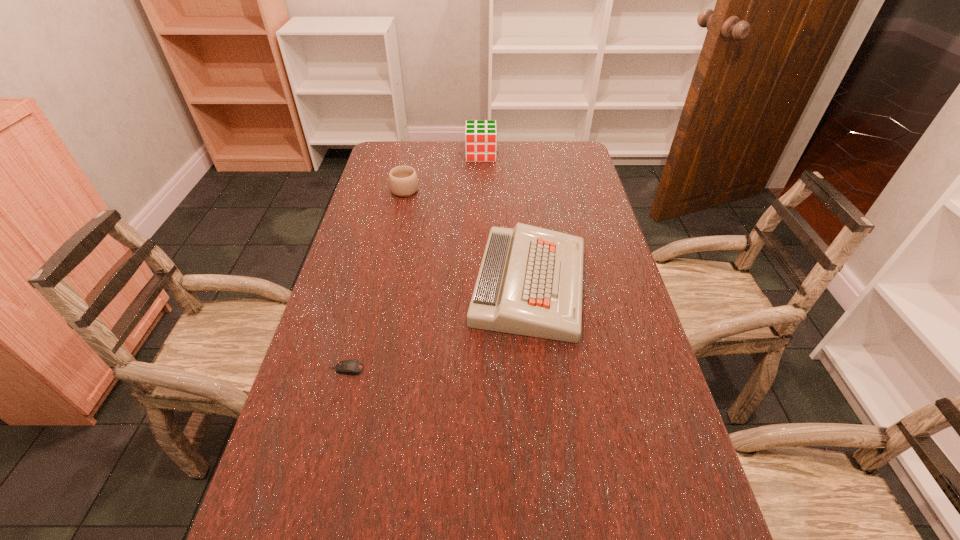
At what (x,y) coordinates should I click in order to perform the action: click on blank space located 0.050m on the back of the third farthest object. Please return your answer as a coordinate pair (x, y). The width and height of the screenshot is (960, 540). Looking at the image, I should click on (523, 227).

Locate an element on the screen. free space located on the right of the nearest object is located at coordinates (527, 369).

At what (x,y) coordinates should I click in order to perform the action: click on object situated at the far edge. Please return your answer as a coordinate pair (x, y). This screenshot has height=540, width=960. Looking at the image, I should click on (480, 135).

Find the location of `mug located in the left edge section of the desktop`. mug located in the left edge section of the desktop is located at coordinates (403, 180).

The image size is (960, 540). What are the coordinates of `computer mouse that is at the left edge` in the screenshot? It's located at (349, 367).

What are the coordinates of `object present at the right edge` in the screenshot? It's located at (530, 282).

You are a GUI agent. You are given a task and a screenshot of the screen. Output one action in this format:
    pyautogui.click(x=<x>, y=<y>)
    Task: Click on the free point at the far edge
    The width and height of the screenshot is (960, 540).
    Given the screenshot: What is the action you would take?
    pyautogui.click(x=533, y=145)

Where is `vacant space at the left edge of the desktop`? Image resolution: width=960 pixels, height=540 pixels. vacant space at the left edge of the desktop is located at coordinates (269, 538).

Locate an element on the screen. Image resolution: width=960 pixels, height=540 pixels. vacant space at the right edge of the desktop is located at coordinates (637, 351).

You are a GUI agent. You are given a task and a screenshot of the screen. Output one action in this format:
    pyautogui.click(x=<x>, y=<y>)
    Task: Click on the vacant position at the far left corner of the desktop
    This screenshot has width=960, height=540.
    Given the screenshot: What is the action you would take?
    pyautogui.click(x=388, y=152)